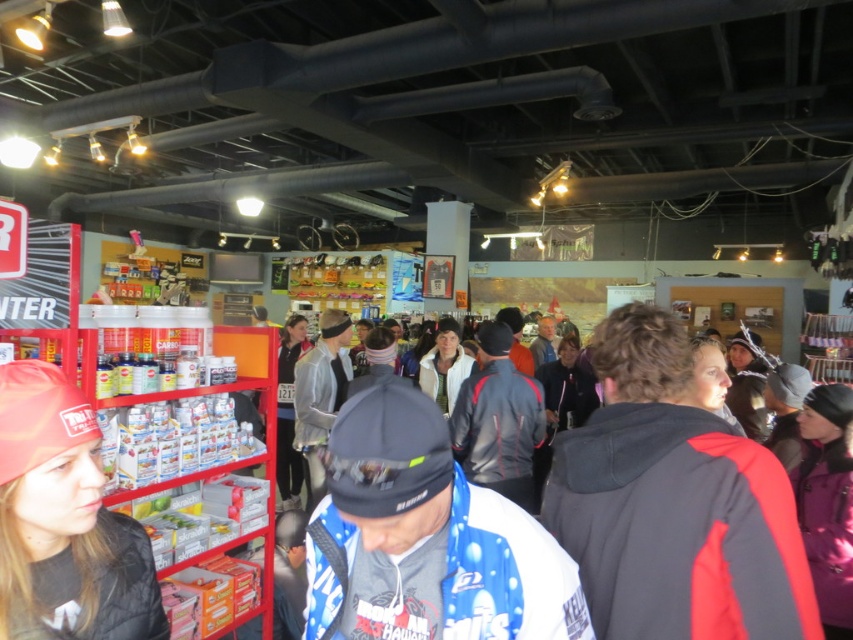
Which is above, black/red jacket at center-right or red knit cap at left?

Positioned higher is black/red jacket at center-right.

Is black/red jacket at center-right below red knit cap at left?

Incorrect, black/red jacket at center-right is not positioned below red knit cap at left.

Where is `black/red jacket at center-right`? The image size is (853, 640). black/red jacket at center-right is located at coordinates (672, 502).

Which of these two, blue fleece jacket at center or red knit cap at left, stands taller?

red knit cap at left is taller.

Who is higher up, blue fleece jacket at center or red knit cap at left?

red knit cap at left is higher up.

Is point (527, 605) behind point (16, 573)?

Yes, it is.

Identify the location of blue fleece jacket at center. The image size is (853, 640). (438, 528).

Is black/red jacket at center-right wider than blue fleece jacket at center?

In fact, black/red jacket at center-right might be narrower than blue fleece jacket at center.

Between black/red jacket at center-right and blue fleece jacket at center, which one is positioned higher?

black/red jacket at center-right is above.

Locate an element on the screen. The image size is (853, 640). black/red jacket at center-right is located at coordinates click(x=672, y=502).